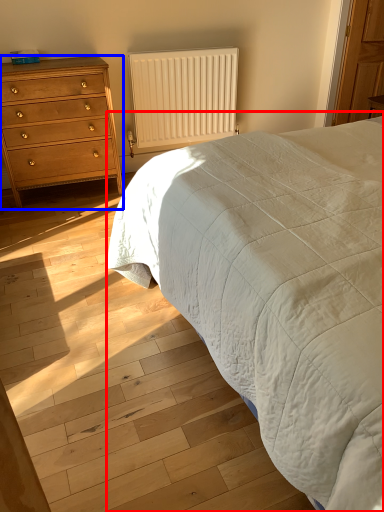
Question: Which object appears closest to the camera in this image, bed (highlighted by a red box) or chest of drawers (highlighted by a blue box)?

Choices:
 (A) bed
 (B) chest of drawers

Answer: (A)